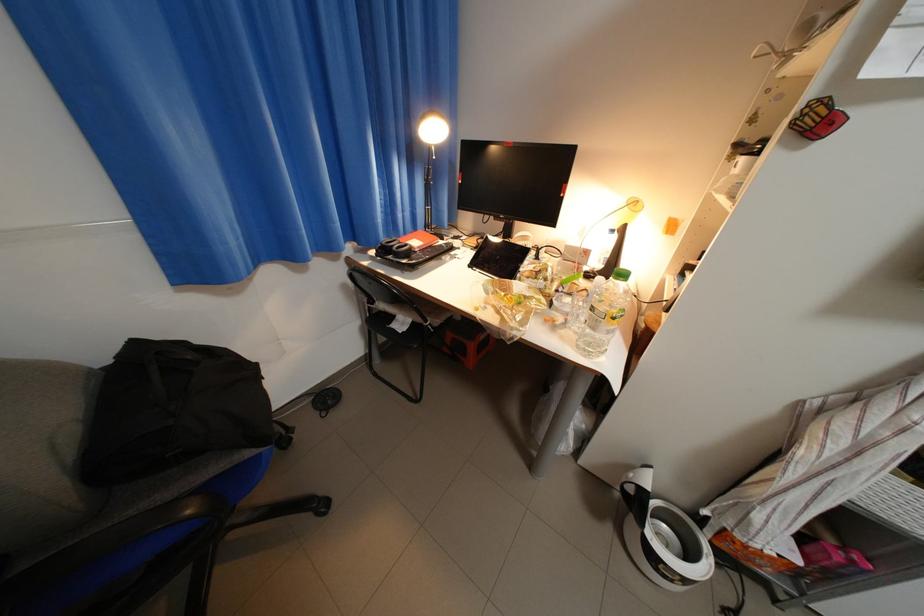
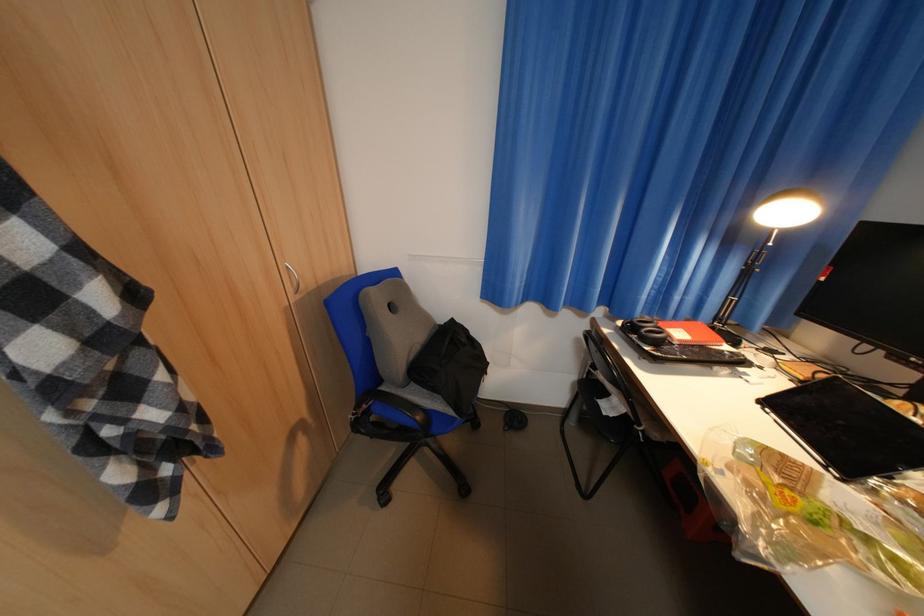
Question: The camera is either moving clockwise (left) or counter-clockwise (right) around the object. The first image is from the beginning of the video and the second image is from the end. Is the camera moving left or right when shooting the video?

Choices:
 (A) Left
 (B) Right

Answer: (B)